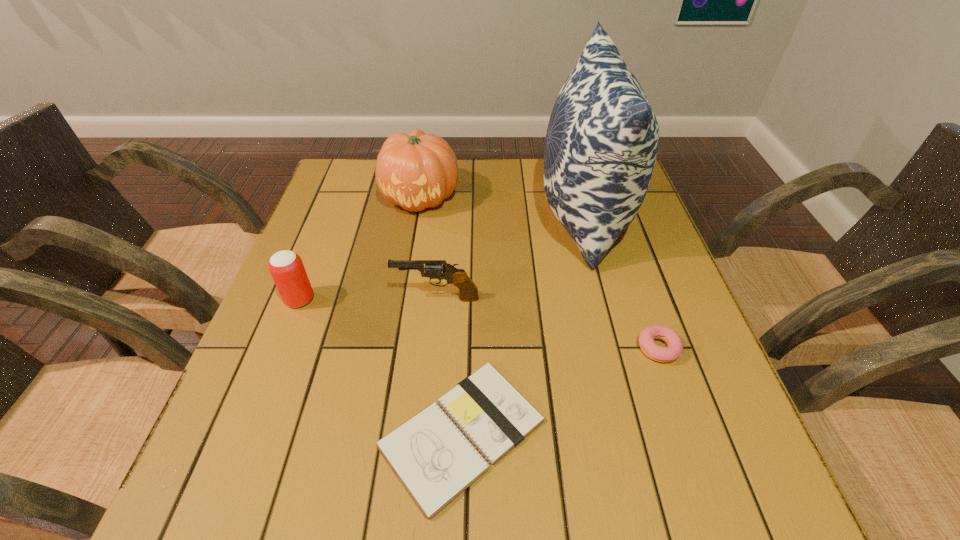
At what (x,y) coordinates should I click in order to perform the action: click on cushion that is at the right edge. Please return your answer as a coordinate pair (x, y). Image resolution: width=960 pixels, height=540 pixels. Looking at the image, I should click on (602, 140).

You are a GUI agent. You are given a task and a screenshot of the screen. Output one action in this format:
    pyautogui.click(x=<x>, y=<y>)
    Task: Click on the doughnut that is positioned at the right edge
    The width and height of the screenshot is (960, 540).
    Given the screenshot: What is the action you would take?
    pyautogui.click(x=646, y=338)

Where is `object at the far right corner`? The image size is (960, 540). object at the far right corner is located at coordinates (602, 140).

Identify the location of free location at the far edge of the desktop. (380, 197).

This screenshot has width=960, height=540. In the image, there is a desktop. What are the coordinates of `vacant space at the near edge` in the screenshot? It's located at (599, 497).

Image resolution: width=960 pixels, height=540 pixels. I want to click on free space at the left edge of the desktop, so [x=283, y=383].

Locate an element on the screen. free space at the right edge of the desktop is located at coordinates (715, 373).

The height and width of the screenshot is (540, 960). Find the location of `free space at the far left corner`. free space at the far left corner is located at coordinates (374, 183).

In order to click on free space at the near left corner of the desktop in this screenshot , I will do `click(291, 471)`.

This screenshot has width=960, height=540. What are the coordinates of `vacant position at the near right corner of the desktop` in the screenshot? It's located at (750, 491).